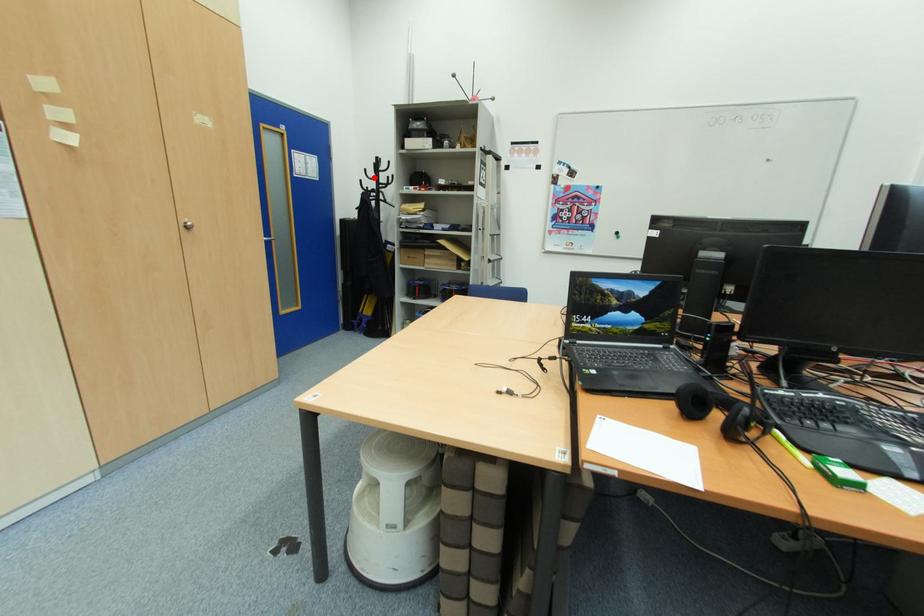
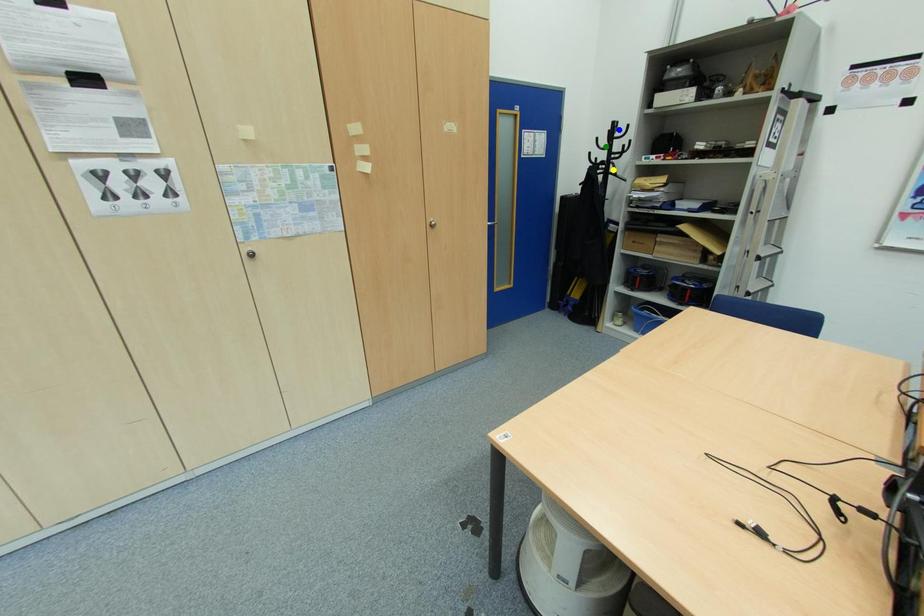
Question: I am providing you with two images of the same scene from different viewpoints. A red point is marked on the first image. You are given multiple points on the second image. In image 2, which mark is for the same physical point as the one in image 1?

Choices:
 (A) yellow point
 (B) blue point
 (C) green point

Answer: (C)